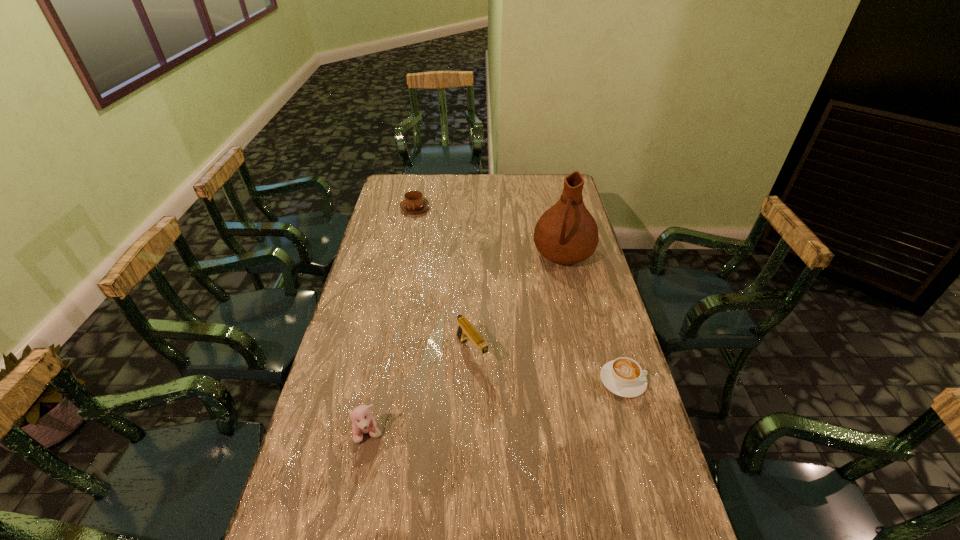
Where is `cappuccino at the right edge`? The width and height of the screenshot is (960, 540). cappuccino at the right edge is located at coordinates (623, 376).

You are a GUI agent. You are given a task and a screenshot of the screen. Output one action in this format:
    pyautogui.click(x=<x>, y=<y>)
    Task: Click on the pitcher at the right edge
    
    Given the screenshot: What is the action you would take?
    pyautogui.click(x=566, y=233)

The width and height of the screenshot is (960, 540). I want to click on vacant space at the far edge of the desktop, so click(427, 174).

At what (x,y) coordinates should I click in order to perform the action: click on vacant space at the left edge of the desktop. Please return your answer as a coordinate pair (x, y). This screenshot has height=540, width=960. Looking at the image, I should click on (385, 321).

What are the coordinates of `vacant region at the right edge` in the screenshot? It's located at (636, 437).

This screenshot has height=540, width=960. I want to click on vacant position at the far left corner of the desktop, so click(x=417, y=175).

The height and width of the screenshot is (540, 960). In the image, there is a desktop. Find the location of `vacant space at the near right corner`. vacant space at the near right corner is located at coordinates (654, 537).

Locate an element on the screen. The height and width of the screenshot is (540, 960). free space between the pitcher and the teddy bear is located at coordinates (467, 344).

The height and width of the screenshot is (540, 960). In order to click on vacant area that lies between the farther cappuccino and the right cappuccino in this screenshot , I will do coord(518,294).

At what (x,y) coordinates should I click in order to perform the action: click on free space between the second farthest object and the nearest object. Please return your answer as a coordinate pair (x, y). Image resolution: width=960 pixels, height=540 pixels. Looking at the image, I should click on (467, 344).